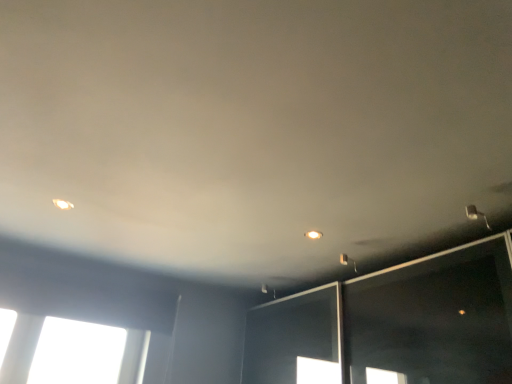
Where is `matte white light fixture at upper right, marked as the second dot in a top-to-bottom arrangement`? The height and width of the screenshot is (384, 512). matte white light fixture at upper right, marked as the second dot in a top-to-bottom arrangement is located at coordinates 313,235.

The height and width of the screenshot is (384, 512). Describe the element at coordinates (313, 235) in the screenshot. I see `matte white light fixture at upper right, which appears as the 1th dot when ordered from the bottom` at that location.

What do you see at coordinates (348, 261) in the screenshot? The image size is (512, 384). I see `matte white light fixture at upper right` at bounding box center [348, 261].

Find the location of a particular element. Image resolution: width=512 pixels, height=384 pixels. matte white light fixture at upper right, which is counted as the second dot, starting from the front is located at coordinates (313, 235).

From a real-world perspective, is matte white light fixture at upper right, which appears as the 1th dot when ordered from the bottom, physically located above or below matte white light fixture at upper right?

matte white light fixture at upper right, which appears as the 1th dot when ordered from the bottom, is above matte white light fixture at upper right.

Considering the sizes of matte white light fixture at upper right, the 1th dot positioned from the back, and matte white light fixture at upper right in the image, is matte white light fixture at upper right, the 1th dot positioned from the back, bigger or smaller than matte white light fixture at upper right?

Considering their sizes, matte white light fixture at upper right, the 1th dot positioned from the back, takes up less space than matte white light fixture at upper right.

Which is closer, (322, 233) or (342, 260)?

Point (322, 233)

From the image's perspective, which object appears higher, matte white light fixture at upper right or matte white light fixture at upper right, which appears as the 1th dot when ordered from the bottom?

matte white light fixture at upper right, which appears as the 1th dot when ordered from the bottom, is shown above in the image.

How far apart are matte white light fixture at upper right and matte white light fixture at upper right, which is counted as the second dot, starting from the front?

matte white light fixture at upper right and matte white light fixture at upper right, which is counted as the second dot, starting from the front, are 13.68 inches apart from each other.

Identify the location of the 1st dot to the left when counting from the matte white light fixture at upper right. (313, 235).

Which of these two, matte white light fixture at upper right or matte white light fixture at upper right, which appears as the 1th dot when ordered from the bottom, is smaller?

Smaller between the two is matte white light fixture at upper right, which appears as the 1th dot when ordered from the bottom.

Does matte white light fixture at upper right, marked as the second dot in a top-to-bottom arrangement, appear on the left side of matte white light fixture at upper left, placed as the second dot when sorted from back to front?

No, matte white light fixture at upper right, marked as the second dot in a top-to-bottom arrangement, is not to the left of matte white light fixture at upper left, placed as the second dot when sorted from back to front.

Which is closer to the camera, (305, 233) or (67, 204)?

The point (67, 204) is closer to the camera.

Is matte white light fixture at upper right, which appears as the 1th dot when ordered from the bottom, not near matte white light fixture at upper left, placed as the second dot when sorted from back to front?

Yes, matte white light fixture at upper right, which appears as the 1th dot when ordered from the bottom, is far from matte white light fixture at upper left, placed as the second dot when sorted from back to front.

Would you say matte white light fixture at upper right, which is counted as the second dot, starting from the front, is inside or outside matte white light fixture at upper left, marked as the second dot in a bottom-to-top arrangement?

matte white light fixture at upper right, which is counted as the second dot, starting from the front, lies outside matte white light fixture at upper left, marked as the second dot in a bottom-to-top arrangement.

Can you confirm if matte white light fixture at upper right is taller than matte white light fixture at upper left, placed as the second dot when sorted from back to front?

Indeed, matte white light fixture at upper right has a greater height compared to matte white light fixture at upper left, placed as the second dot when sorted from back to front.

Which is more to the right, matte white light fixture at upper right or matte white light fixture at upper left, acting as the 1th dot starting from the top?

From the viewer's perspective, matte white light fixture at upper right appears more on the right side.

From a real-world perspective, relative to matte white light fixture at upper left, the 2th dot in the right-to-left sequence, is matte white light fixture at upper right vertically above or below?

matte white light fixture at upper right is situated lower than matte white light fixture at upper left, the 2th dot in the right-to-left sequence, in the real world.

Could you tell me if matte white light fixture at upper right is facing matte white light fixture at upper left, placed as the second dot when sorted from back to front?

No, matte white light fixture at upper right is not aimed at matte white light fixture at upper left, placed as the second dot when sorted from back to front.

Who is taller, matte white light fixture at upper left, the 2th dot in the right-to-left sequence, or matte white light fixture at upper right, the 1th dot positioned from the back?

Standing taller between the two is matte white light fixture at upper right, the 1th dot positioned from the back.

In the scene shown: How much distance is there between matte white light fixture at upper left, placed as the second dot when sorted from back to front, and matte white light fixture at upper right, the 1th dot from the right?

matte white light fixture at upper left, placed as the second dot when sorted from back to front, is 1.18 meters from matte white light fixture at upper right, the 1th dot from the right.

Looking at this image, from the image's perspective, is matte white light fixture at upper left, which is the first dot from front to back, beneath matte white light fixture at upper right, the 1th dot from the right?

No, from the image's perspective, matte white light fixture at upper left, which is the first dot from front to back, is not beneath matte white light fixture at upper right, the 1th dot from the right.

Which point is more distant from viewer, (x=60, y=199) or (x=311, y=238)?

Positioned behind is point (x=311, y=238).

From the image's perspective, is matte white light fixture at upper left, which is the first dot from front to back, on top of matte white light fixture at upper right?

Yes.

Does matte white light fixture at upper left, which is the first dot from front to back, have a greater height compared to matte white light fixture at upper right?

No.

Is matte white light fixture at upper left, the first dot viewed from the left, wider than matte white light fixture at upper right?

Incorrect, the width of matte white light fixture at upper left, the first dot viewed from the left, does not surpass that of matte white light fixture at upper right.

Would you consider matte white light fixture at upper left, marked as the second dot in a bottom-to-top arrangement, to be distant from matte white light fixture at upper right?

matte white light fixture at upper left, marked as the second dot in a bottom-to-top arrangement, is positioned a significant distance from matte white light fixture at upper right.

This screenshot has height=384, width=512. What are the coordinates of `light fixture behind the matte white light fixture at upper right, the 1th dot from the right` in the screenshot? It's located at (348, 261).

Find the location of a particular element. This screenshot has width=512, height=384. dot that is the 1st one when counting forward from the matte white light fixture at upper right is located at coordinates (313, 235).

Looking at the image, which one is located closer to matte white light fixture at upper right, matte white light fixture at upper left, which is the first dot from front to back, or matte white light fixture at upper right, the 2th dot viewed from the left?

The object closer to matte white light fixture at upper right is matte white light fixture at upper right, the 2th dot viewed from the left.

Looking at the image, which one is located closer to matte white light fixture at upper right, matte white light fixture at upper right, the 2th dot viewed from the left, or matte white light fixture at upper left, marked as the second dot in a bottom-to-top arrangement?

matte white light fixture at upper right, the 2th dot viewed from the left, lies closer to matte white light fixture at upper right than the other object.

Considering their positions, is matte white light fixture at upper right positioned closer to matte white light fixture at upper left, the 2th dot in the right-to-left sequence, than matte white light fixture at upper right, which is counted as the second dot, starting from the front?

matte white light fixture at upper right, which is counted as the second dot, starting from the front, lies closer to matte white light fixture at upper left, the 2th dot in the right-to-left sequence, than the other object.

Based on their spatial positions, is matte white light fixture at upper right or matte white light fixture at upper left, placed as the second dot when sorted from back to front, closer to matte white light fixture at upper right, the 2th dot viewed from the left?

matte white light fixture at upper right is positioned closer to the anchor matte white light fixture at upper right, the 2th dot viewed from the left.

Considering their positions, is matte white light fixture at upper right, the 1th dot positioned from the back, positioned further to matte white light fixture at upper left, marked as the second dot in a bottom-to-top arrangement, than matte white light fixture at upper right?

Among the two, matte white light fixture at upper right is located further to matte white light fixture at upper left, marked as the second dot in a bottom-to-top arrangement.

Estimate the real-world distances between objects in this image. Which object is closer to matte white light fixture at upper right, the 1th dot from the right, matte white light fixture at upper left, the 2th dot in the right-to-left sequence, or matte white light fixture at upper right?

Among the two, matte white light fixture at upper right is located nearer to matte white light fixture at upper right, the 1th dot from the right.

This screenshot has height=384, width=512. I want to click on dot between matte white light fixture at upper left, placed as the second dot when sorted from back to front, and matte white light fixture at upper right, so click(313, 235).